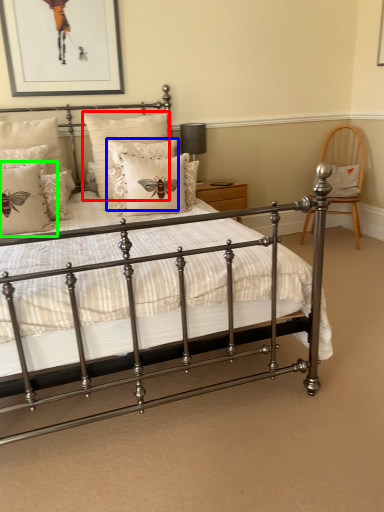
Question: Estimate the real-world distances between objects in this image. Which object is farther from pillow (highlighted by a red box), pillow (highlighted by a blue box) or pillow (highlighted by a green box)?

Choices:
 (A) pillow
 (B) pillow

Answer: (B)